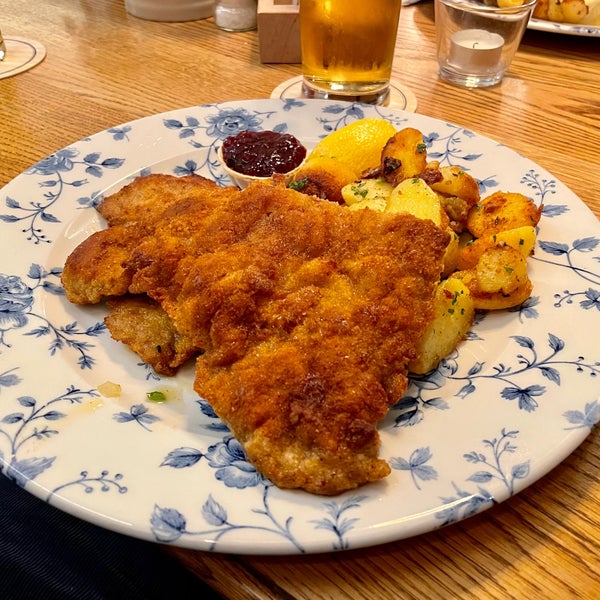
The image size is (600, 600). I want to click on small paper cup, so click(245, 180).